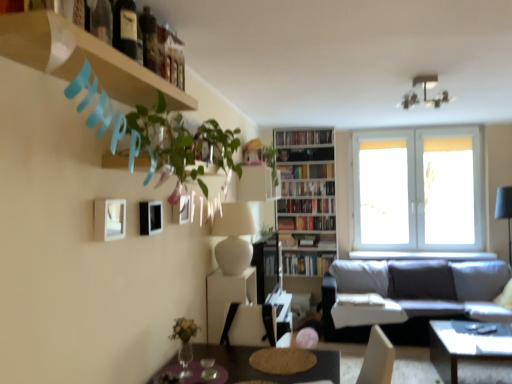
Find the location of a particular element. empty space that is ontop of hardcover book at center, positioned as the fifth book in bottom-to-top order is located at coordinates (319, 163).